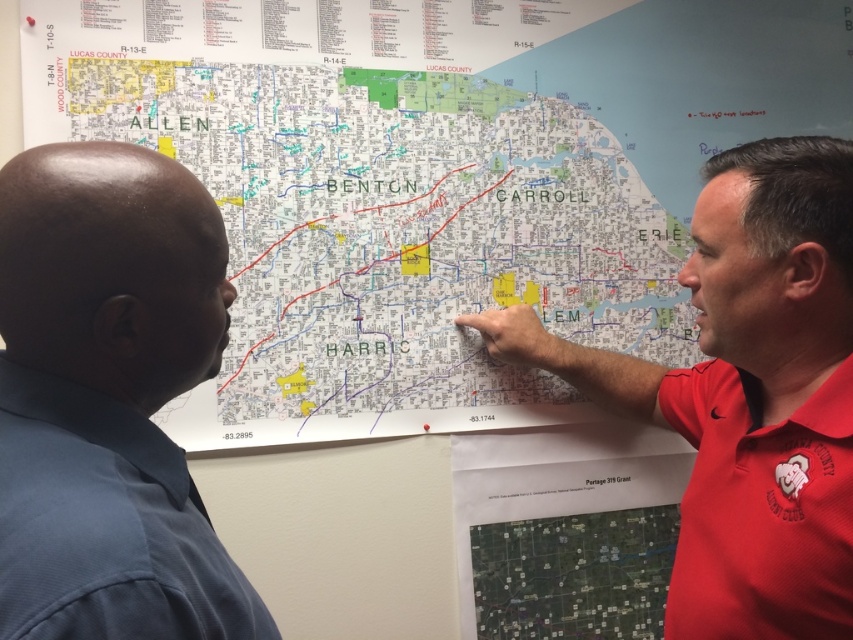
You are a visitor at a community meeting and see the red shirt at upper right and the red cotton polo shirt at right. Which one is wider?

The red shirt at upper right is wider than the red cotton polo shirt at right.

You are a visitor at a community meeting and need to approach the two people discussing the map. The red shirt at upper right and the red cotton polo shirt at right are standing near each other. How far apart are they in centimeters?

The red shirt at upper right and the red cotton polo shirt at right are 3.91 centimeters apart from each other.